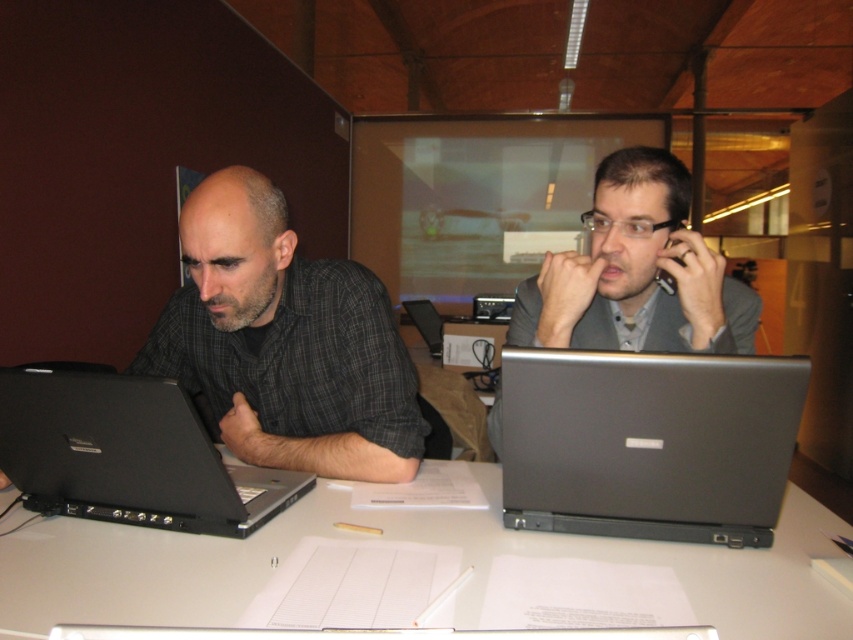
Question: Is silver metallic laptop at right thinner than black matte laptop at left?

Choices:
 (A) no
 (B) yes

Answer: (B)

Question: Estimate the real-world distances between objects in this image. Which object is closer to the silver metallic laptop at right?

Choices:
 (A) matte gray suit at right
 (B) black matte laptop at left

Answer: (A)

Question: Does silver metallic laptop at right have a greater width compared to black matte laptop at left?

Choices:
 (A) yes
 (B) no

Answer: (B)

Question: Which of the following is the closest to the observer?

Choices:
 (A) white plastic table at center
 (B) silver metallic laptop at right
 (C) black matte laptop at left
 (D) matte black shirt at left

Answer: (A)

Question: Where is matte black shirt at left located in relation to matte gray suit at right in the image?

Choices:
 (A) left
 (B) right

Answer: (A)

Question: Which point is closer to the camera?

Choices:
 (A) matte gray suit at right
 (B) silver metallic laptop at right

Answer: (B)